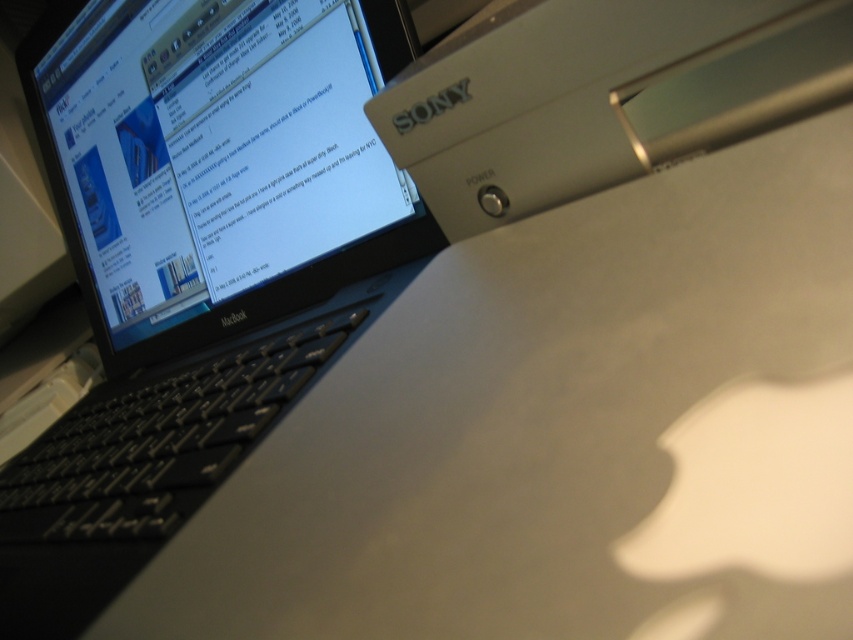
You are organizing items on your desk and need to place a new item between the matte black laptop at upper left and the satin silver power supply at upper right. Based on their positions, which item is closer to you where you should start placing the new item?

The matte black laptop at upper left is closer to you than the satin silver power supply at upper right, so you should start placing the new item near the matte black laptop at upper left.